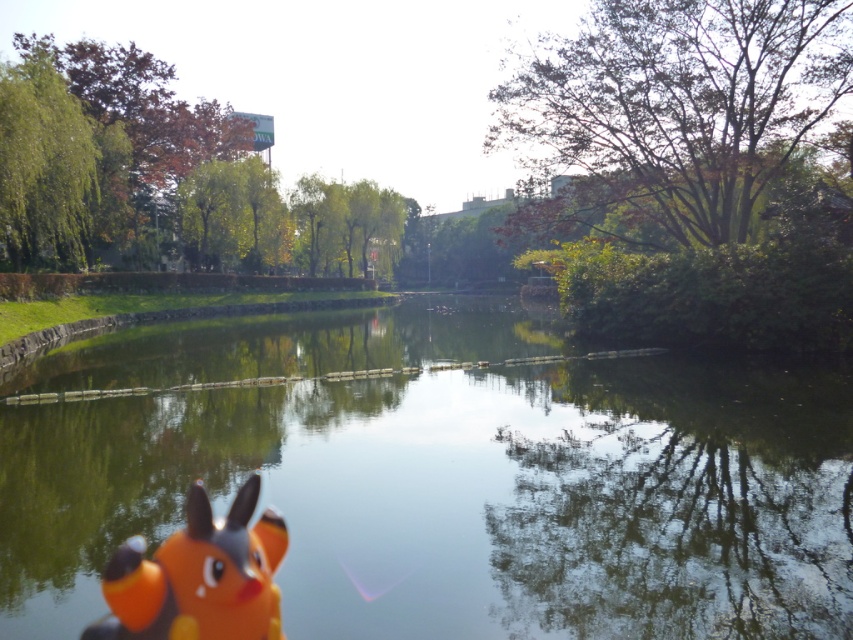
Question: Which point is closer to the camera?

Choices:
 (A) (747, 90)
 (B) (296, 417)

Answer: (B)

Question: Which point is farther to the camera?

Choices:
 (A) (51, 356)
 (B) (48, 177)

Answer: (B)

Question: Does orange matte pikachu at lower left lie behind green leafy tree at left?

Choices:
 (A) no
 (B) yes

Answer: (A)

Question: Is green glossy water at center to the right of orange matte pikachu at lower left from the viewer's perspective?

Choices:
 (A) yes
 (B) no

Answer: (B)

Question: Is orange matte pikachu at lower left thinner than green leafy tree at left?

Choices:
 (A) yes
 (B) no

Answer: (A)

Question: Which of these objects is positioned closest to the green leafy tree at upper right?

Choices:
 (A) green leafy tree at left
 (B) green leafy tree at center

Answer: (A)